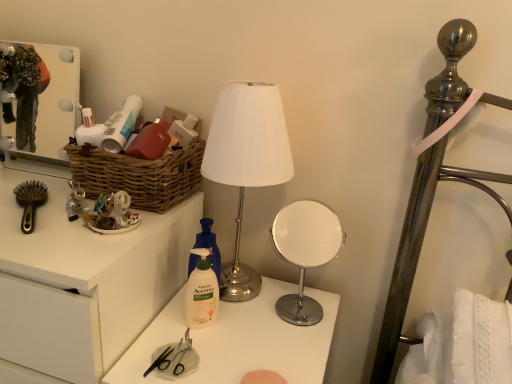
The image size is (512, 384). Identify the location of vacant area on the back side of brown plastic brush at left. (51, 195).